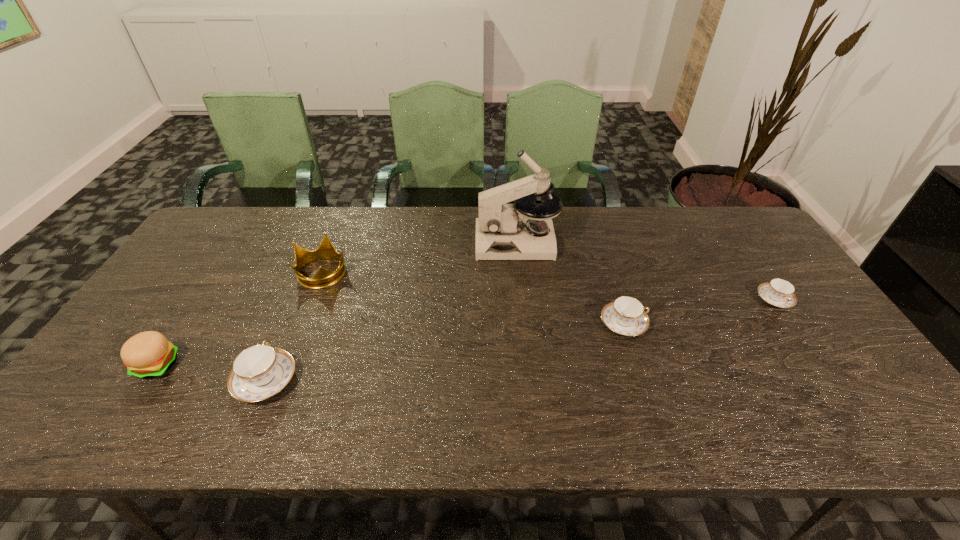
You are a GUI agent. You are given a task and a screenshot of the screen. Output one action in this format:
    pyautogui.click(x=<x>, y=<y>)
    Task: Click on the tallest teacup
    This screenshot has height=540, width=960.
    Given the screenshot: What is the action you would take?
    pyautogui.click(x=260, y=371)

What are the coordinates of `the leftmost teacup` in the screenshot? It's located at (260, 371).

At what (x,y) coordinates should I click in order to perform the action: click on the fifth object from left to right. Please return your answer as a coordinate pair (x, y). The height and width of the screenshot is (540, 960). Looking at the image, I should click on (626, 316).

Locate an element on the screen. the second tallest teacup is located at coordinates (626, 316).

Find the location of a particular element. Image resolution: width=960 pixels, height=540 pixels. the shortest object is located at coordinates (778, 292).

Locate an element on the screen. The image size is (960, 540). the rightmost teacup is located at coordinates (x=778, y=292).

Image resolution: width=960 pixels, height=540 pixels. I want to click on crown, so click(x=324, y=278).

You are a GUI agent. You are given a task and a screenshot of the screen. Output one action in this format:
    pyautogui.click(x=<x>, y=<y>)
    Task: Click on the fourth object from left to right
    This screenshot has height=540, width=960.
    Given the screenshot: What is the action you would take?
    pyautogui.click(x=504, y=231)

In order to click on microscope in this screenshot , I will do `click(504, 231)`.

This screenshot has width=960, height=540. Identify the location of hamburger. (149, 354).